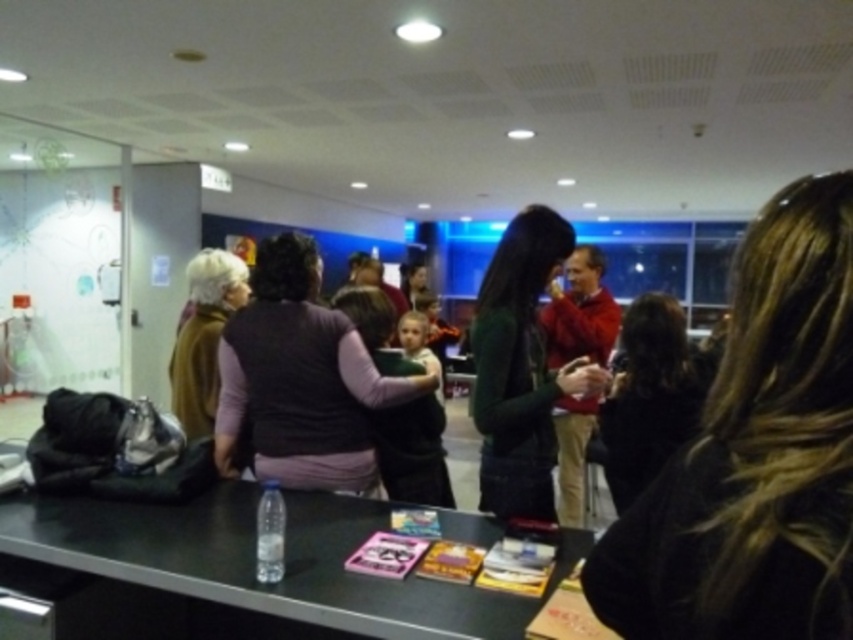
Question: Which of the following is the closest to the observer?

Choices:
 (A) brown wool sweater at left
 (B) dark gray sweater at center
 (C) clear plastic bottle at lower left
 (D) black matte table at lower center

Answer: (D)

Question: Which point is closer to the camera?

Choices:
 (A) (309, 372)
 (B) (190, 422)

Answer: (A)

Question: Can you confirm if dark brown hair at center is smaller than brown wool sweater at left?

Choices:
 (A) yes
 (B) no

Answer: (A)

Question: Which point is closer to the camera taking this photo?

Choices:
 (A) (238, 416)
 (B) (177, 356)

Answer: (A)

Question: Is brown wool sweater at left behind clear plastic bottle at lower left?

Choices:
 (A) yes
 (B) no

Answer: (A)

Question: Can you confirm if black matte table at lower center is positioned above black fabric hair at center?

Choices:
 (A) yes
 (B) no

Answer: (B)